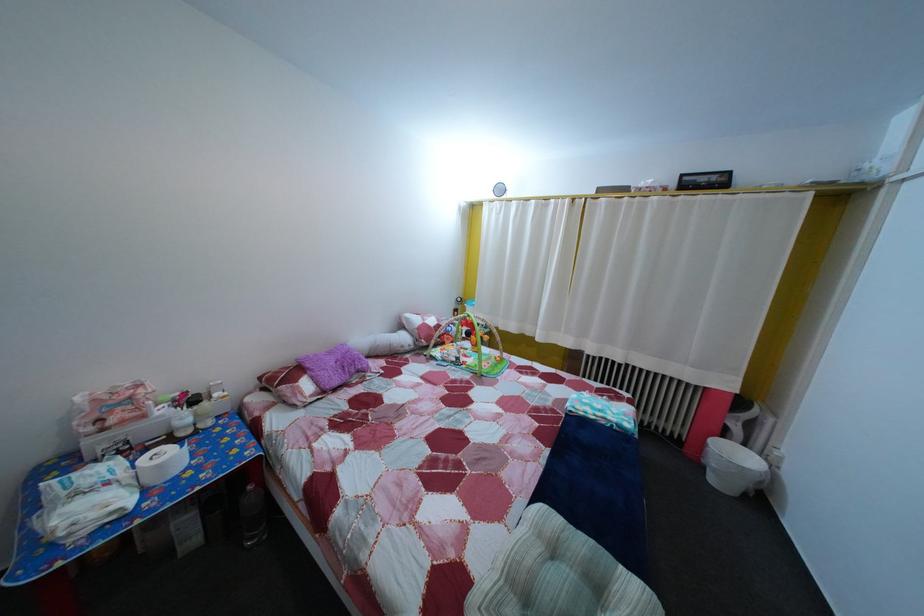
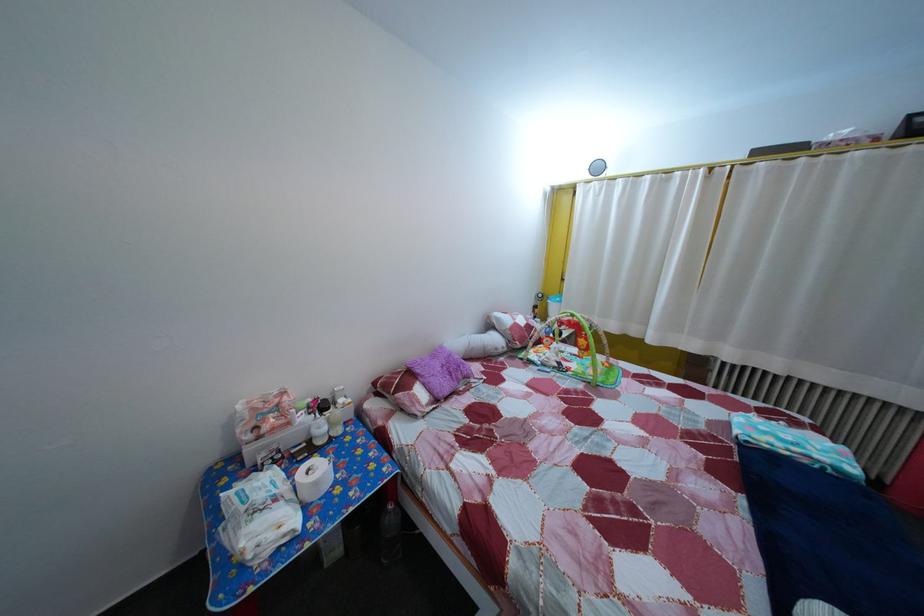
Where in the second image is the point corresponding to point 172,419 from the first image?

(311, 427)